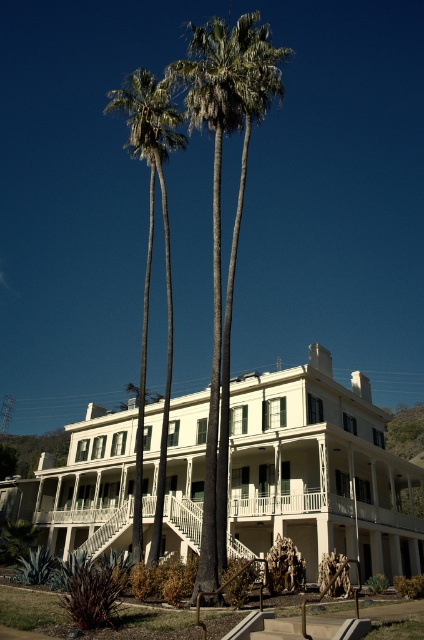
Between point (220, 413) and point (128, 113), which one is positioned in front?

Point (220, 413)

Find the location of a particular element. The width and height of the screenshot is (424, 640). green leafy palm tree at center is located at coordinates (220, 218).

Find the location of a particular element. This screenshot has width=424, height=640. green leafy palm tree at center is located at coordinates (220, 218).